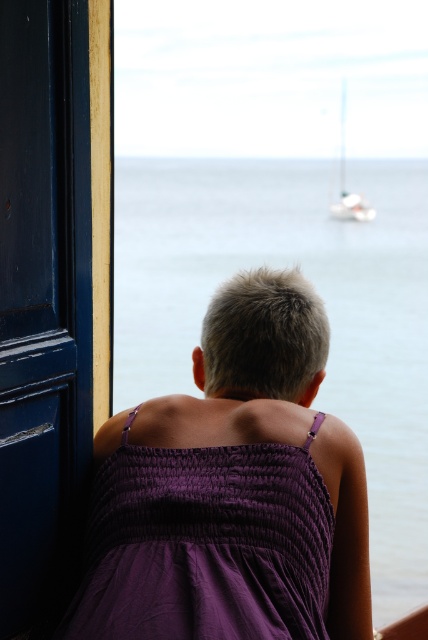
Question: Is purple satin dress at center closer to camera compared to white glossy sailboat at upper right?

Choices:
 (A) no
 (B) yes

Answer: (B)

Question: Which point appears farthest from the camera in this image?

Choices:
 (A) (323, 532)
 (B) (339, 161)

Answer: (B)

Question: Can you confirm if purple satin dress at center is smaller than white glossy sailboat at upper right?

Choices:
 (A) yes
 (B) no

Answer: (A)

Question: In this image, where is purple satin dress at center located relative to white glossy sailboat at upper right?

Choices:
 (A) below
 (B) above

Answer: (A)

Question: Which point is closer to the camera?

Choices:
 (A) (249, 272)
 (B) (360, 211)

Answer: (A)